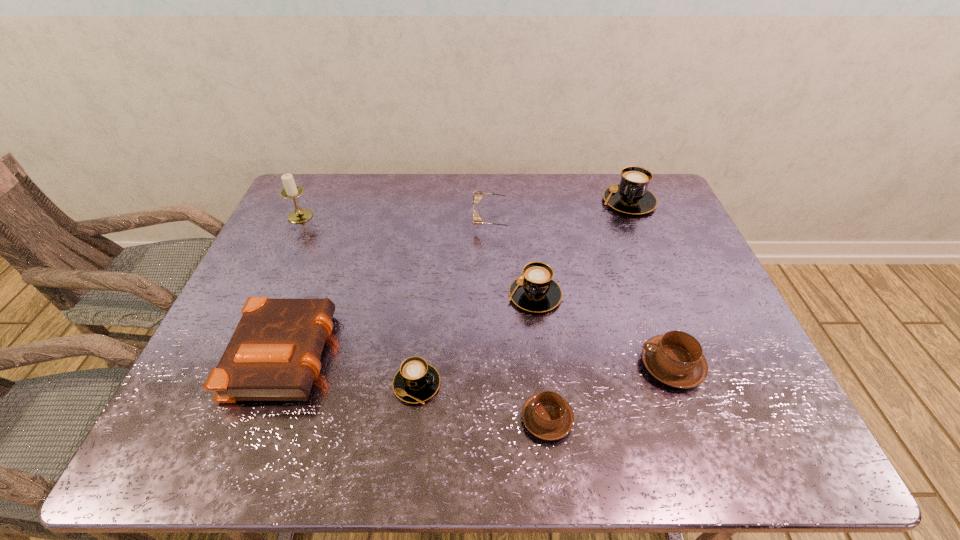
The image size is (960, 540). In the image, there is a desktop. What are the coordinates of `free space at the far left corner` in the screenshot? It's located at tap(301, 205).

I want to click on free space between the sunglasses and the leftmost black cappuccino, so click(x=456, y=302).

This screenshot has width=960, height=540. I want to click on vacant space in between the sixth object from right to left and the Bible, so click(351, 368).

The image size is (960, 540). In order to click on empty location between the nearer brown cappuccino and the bigger brown cappuccino in this screenshot , I will do 610,392.

Where is `empty space between the Bible and the leftmost cappuccino`? Image resolution: width=960 pixels, height=540 pixels. empty space between the Bible and the leftmost cappuccino is located at coordinates (351, 368).

Locate an element on the screen. This screenshot has width=960, height=540. free spot between the tallest cappuccino and the fourth nearest cappuccino is located at coordinates (582, 248).

Locate an element on the screen. This screenshot has height=540, width=960. blank region between the right brown cappuccino and the left brown cappuccino is located at coordinates (610, 392).

Find the location of `free space between the Bible and the biggest black cappuccino`. free space between the Bible and the biggest black cappuccino is located at coordinates (457, 276).

In order to click on free space between the left brown cappuccino and the second farthest cappuccino in this screenshot , I will do `click(540, 357)`.

The width and height of the screenshot is (960, 540). I want to click on free space between the second tallest object and the sunglasses, so click(x=562, y=211).